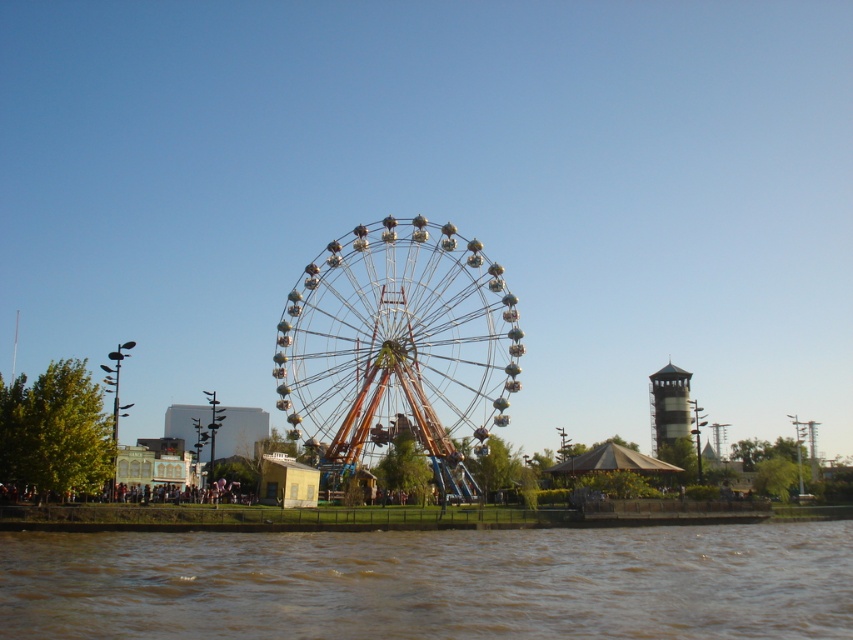
Question: Among these objects, which one is farthest from the camera?

Choices:
 (A) brown muddy water at lower center
 (B) metallic silver ferris wheel at center
 (C) metallic gray tower at right

Answer: (C)

Question: Which point is closer to the camera?

Choices:
 (A) metallic gray tower at right
 (B) brown muddy water at lower center

Answer: (B)

Question: Can you confirm if brown muddy water at lower center is bigger than metallic silver ferris wheel at center?

Choices:
 (A) no
 (B) yes

Answer: (B)

Question: Among these points, which one is farthest from the camera?

Choices:
 (A) (467, 323)
 (B) (836, 612)
 (C) (670, 374)

Answer: (C)

Question: Can you confirm if metallic silver ferris wheel at center is positioned above metallic gray tower at right?

Choices:
 (A) yes
 (B) no

Answer: (A)

Question: Is metallic silver ferris wheel at center to the right of metallic gray tower at right from the viewer's perspective?

Choices:
 (A) no
 (B) yes

Answer: (A)